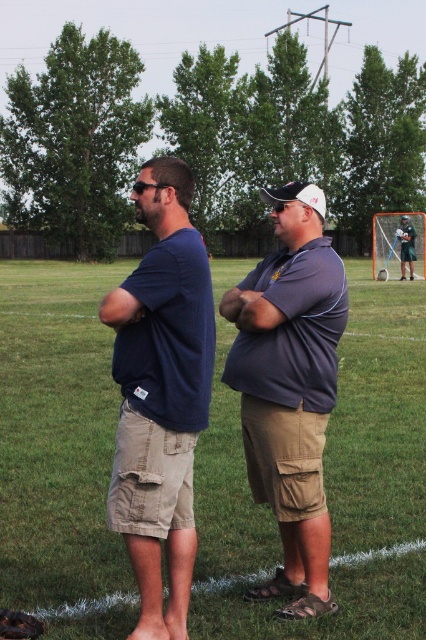
Question: Among these objects, which one is farthest from the camera?

Choices:
 (A) dark blue t-shirt at center
 (B) dark blue shirt at center
 (C) white matte baseball cap at center

Answer: (C)

Question: Considering the relative positions of dark blue shirt at center and matte gray shirt at center in the image provided, where is dark blue shirt at center located with respect to matte gray shirt at center?

Choices:
 (A) above
 (B) below

Answer: (A)

Question: Estimate the real-world distances between objects in this image. Which object is farther from the dark blue t-shirt at center?

Choices:
 (A) dark blue shirt at center
 (B) matte gray shirt at center

Answer: (B)

Question: Is dark blue t-shirt at center bigger than white matte baseball cap at center?

Choices:
 (A) no
 (B) yes

Answer: (A)

Question: Which is nearer to the matte gray shirt at center?

Choices:
 (A) white matte baseball cap at center
 (B) dark blue t-shirt at center
 (C) dark blue shirt at center

Answer: (C)

Question: Where is dark blue t-shirt at center located in relation to white matte baseball cap at center in the image?

Choices:
 (A) left
 (B) right

Answer: (A)